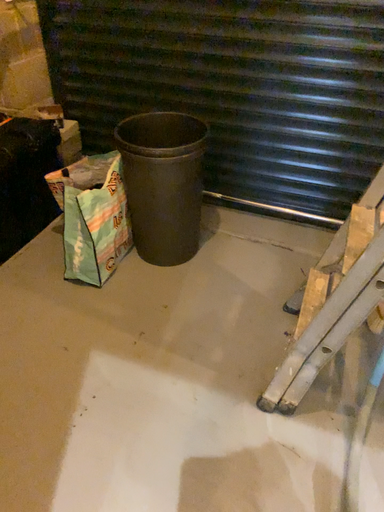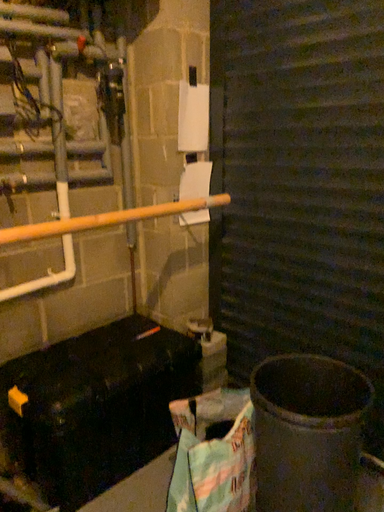
Question: How did the camera likely rotate when shooting the video?

Choices:
 (A) rotated right
 (B) rotated left

Answer: (B)